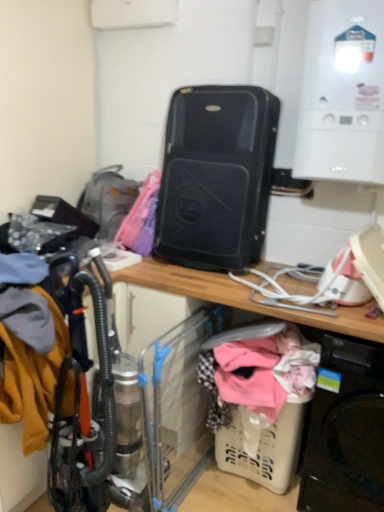
Identify the location of plastic/transparent baby carriage at lower center. This screenshot has height=512, width=384. (260, 405).

Based on the photo, measure the distance between point (344, 397) and camera.

Point (344, 397) is 1.65 meters away from camera.

At what (x,y) coordinates should I click in order to perform the action: click on black matte suitcase at center. Please return your answer as a coordinate pair (x, y). This screenshot has width=384, height=512. Looking at the image, I should click on (216, 176).

At what (x,y) coordinates should I click in order to perform the action: click on white glossy boiler at upper right. Please return your answer as a coordinate pair (x, y). Looking at the image, I should click on (342, 94).

From a real-world perspective, is white glossy boiler at upper right positioned under matte gray backpack at left based on gravity?

Incorrect, from a real-world perspective, white glossy boiler at upper right is higher than matte gray backpack at left.

Considering the sizes of objects white glossy boiler at upper right and matte gray backpack at left in the image provided, who is thinner, white glossy boiler at upper right or matte gray backpack at left?

Thinner between the two is white glossy boiler at upper right.

Choose the correct answer: Is white glossy boiler at upper right inside matte gray backpack at left or outside it?

white glossy boiler at upper right is spatially situated outside matte gray backpack at left.

What's the angular difference between plastic/transparent baby carriage at lower center and black plastic suitcase at center's facing directions?

3.41 degrees separate the facing orientations of plastic/transparent baby carriage at lower center and black plastic suitcase at center.

Considering the relative positions of plastic/transparent baby carriage at lower center and black plastic suitcase at center in the image provided, is plastic/transparent baby carriage at lower center to the left of black plastic suitcase at center from the viewer's perspective?

In fact, plastic/transparent baby carriage at lower center is to the right of black plastic suitcase at center.

Where is `desk on the left of plastic/transparent baby carriage at lower center`? desk on the left of plastic/transparent baby carriage at lower center is located at coordinates (243, 297).

Is plastic/transparent baby carriage at lower center shorter than black plastic suitcase at center?

Yes, plastic/transparent baby carriage at lower center is shorter than black plastic suitcase at center.

Is black plastic washing machine at lower right outside of black plastic suitcase at center?

No, black plastic washing machine at lower right is not entirely external to black plastic suitcase at center.

In the image, is black plastic washing machine at lower right on the left side or the right side of black plastic suitcase at center?

Clearly, black plastic washing machine at lower right is on the right of black plastic suitcase at center in the image.

Is black plastic washing machine at lower right smaller than black plastic suitcase at center?

Yes, black plastic washing machine at lower right is smaller than black plastic suitcase at center.

This screenshot has height=512, width=384. Identify the location of washing machine that is under the black plastic suitcase at center (from a real-world perspective). (346, 431).

Which is in front, black matte suitcase at center or black plastic suitcase at center?

black plastic suitcase at center.

Can you confirm if black matte suitcase at center is wider than black plastic suitcase at center?

No, black matte suitcase at center is not wider than black plastic suitcase at center.

From the image's perspective, is black matte suitcase at center under black plastic suitcase at center?

No, from the image's perspective, black matte suitcase at center is not below black plastic suitcase at center.

Does point (273, 372) come closer to viewer compared to point (345, 150)?

No, (273, 372) is behind (345, 150).

Which object is closer to the camera, plastic/transparent baby carriage at lower center or white glossy boiler at upper right?

white glossy boiler at upper right.

From a real-world perspective, is plastic/transparent baby carriage at lower center on top of white glossy boiler at upper right?

No.

Is plastic/transparent baby carriage at lower center positioned far away from white glossy boiler at upper right?

Yes, plastic/transparent baby carriage at lower center and white glossy boiler at upper right are located far from each other.

How many degrees apart are the facing directions of white glossy boiler at upper right and black plastic suitcase at center?

0.192 degrees.

What are the coordinates of `desk below the white glossy boiler at upper right (from the image's perspective)` in the screenshot? It's located at (243, 297).

Is point (321, 91) in front of point (251, 488)?

That is True.

Considering the sizes of objects white glossy boiler at upper right and black plastic suitcase at center in the image provided, who is wider, white glossy boiler at upper right or black plastic suitcase at center?

With larger width is black plastic suitcase at center.

Identify the location of luggage and bags above the plastic/transparent baby carriage at lower center (from a real-world perspective). (216, 176).

Is point (211, 150) behind point (255, 462)?

No.

Is plastic/transparent baby carriage at lower center located within black matte suitcase at center?

No, plastic/transparent baby carriage at lower center is not surrounded by black matte suitcase at center.

In the scene shown: Between black matte suitcase at center and plastic/transparent baby carriage at lower center, which one has smaller size?

Smaller between the two is plastic/transparent baby carriage at lower center.

Locate an element on the screen. appliance in front of the matte gray backpack at left is located at coordinates (342, 94).

The image size is (384, 512). Identify the location of desk on the left of plastic/transparent baby carriage at lower center. (243, 297).

Based on their spatial positions, is black plastic washing machine at lower right or matte gray backpack at left closer to black matte suitcase at center?

matte gray backpack at left lies closer to black matte suitcase at center than the other object.

Looking at the image, which one is located further to black matte suitcase at center, black plastic suitcase at center or white glossy boiler at upper right?

black plastic suitcase at center.

Estimate the real-world distances between objects in this image. Which object is closer to matte gray backpack at left, black plastic washing machine at lower right or black matte suitcase at center?

black matte suitcase at center lies closer to matte gray backpack at left than the other object.

Estimate the real-world distances between objects in this image. Which object is further from matte gray backpack at left, plastic/transparent baby carriage at lower center or black plastic washing machine at lower right?

black plastic washing machine at lower right lies further to matte gray backpack at left than the other object.

Which object lies further to the anchor point white glossy boiler at upper right, black plastic suitcase at center or black plastic washing machine at lower right?

Among the two, black plastic washing machine at lower right is located further to white glossy boiler at upper right.

Based on their spatial positions, is black plastic suitcase at center or black matte suitcase at center closer to plastic/transparent baby carriage at lower center?

black plastic suitcase at center.

Based on their spatial positions, is plastic/transparent baby carriage at lower center or white glossy boiler at upper right closer to black plastic suitcase at center?

Based on the image, plastic/transparent baby carriage at lower center appears to be nearer to black plastic suitcase at center.

Looking at the image, which one is located further to black matte suitcase at center, black plastic washing machine at lower right or plastic/transparent baby carriage at lower center?

black plastic washing machine at lower right.

Find the location of a particular element. Image resolution: width=384 pixels, height=512 pixels. baby carriage between black plastic suitcase at center and matte gray backpack at left in the front-back direction is located at coordinates (260, 405).

The height and width of the screenshot is (512, 384). I want to click on luggage and bags between white glossy boiler at upper right and black plastic washing machine at lower right from top to bottom, so click(x=216, y=176).

The image size is (384, 512). What are the coordinates of `backpack between white glossy boiler at upper right and black plastic washing machine at lower right vertically` in the screenshot? It's located at (108, 199).

This screenshot has height=512, width=384. I want to click on backpack between white glossy boiler at upper right and plastic/transparent baby carriage at lower center in the vertical direction, so click(108, 199).